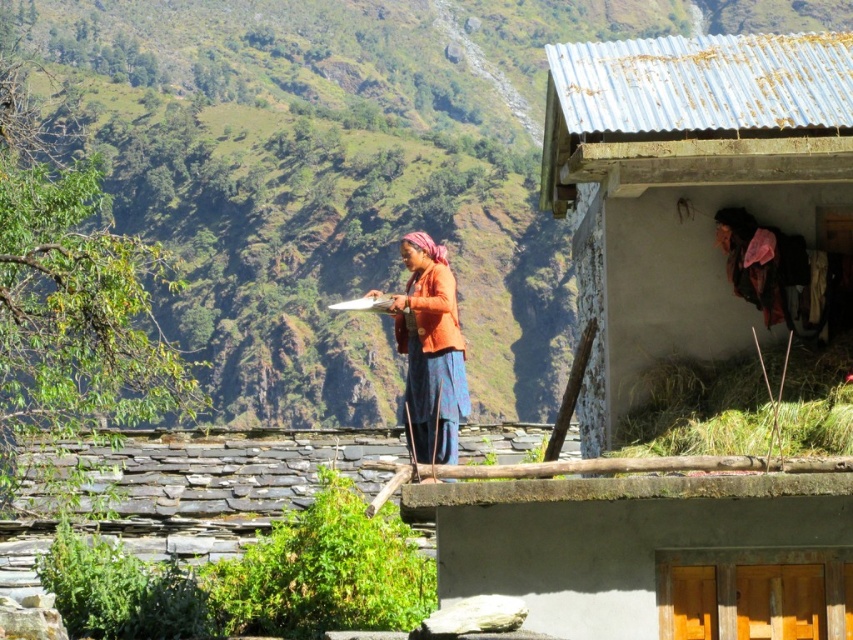
Which of these two, green straw at lower right or orange fabric at center, stands taller?

Standing taller between the two is orange fabric at center.

Who is positioned more to the left, green straw at lower right or orange fabric at center?

orange fabric at center is more to the left.

Is point (727, 422) positioned before point (410, 280)?

That is True.

Where is `green straw at lower right`? The width and height of the screenshot is (853, 640). green straw at lower right is located at coordinates (704, 408).

What do you see at coordinates (341, 172) in the screenshot? I see `green grassy hillside at upper left` at bounding box center [341, 172].

From the picture: Between green grassy hillside at upper left and rusty corrugated metal hut at upper right, which one is positioned lower?

rusty corrugated metal hut at upper right is below.

Where is `green grassy hillside at upper left`? green grassy hillside at upper left is located at coordinates (341, 172).

Does green grassy hillside at upper left have a greater width compared to orange fabric at center?

Indeed, green grassy hillside at upper left has a greater width compared to orange fabric at center.

Between green grassy hillside at upper left and orange fabric at center, which one has less height?

Standing shorter between the two is orange fabric at center.

Who is more distant from viewer, (263, 138) or (404, 403)?

The point (263, 138) is more distant.

What are the coordinates of `green grassy hillside at upper left` in the screenshot? It's located at (341, 172).